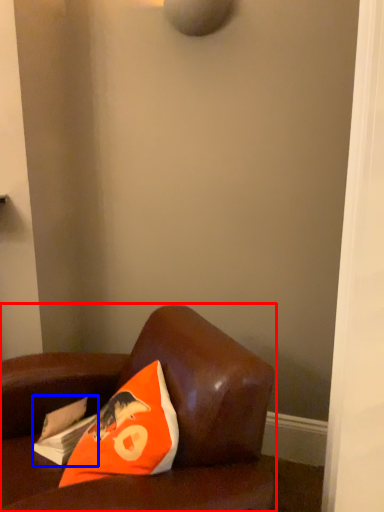
Question: Which object appears farthest to the camera in this image, furniture (highlighted by a red box) or magazine (highlighted by a blue box)?

Choices:
 (A) furniture
 (B) magazine

Answer: (B)